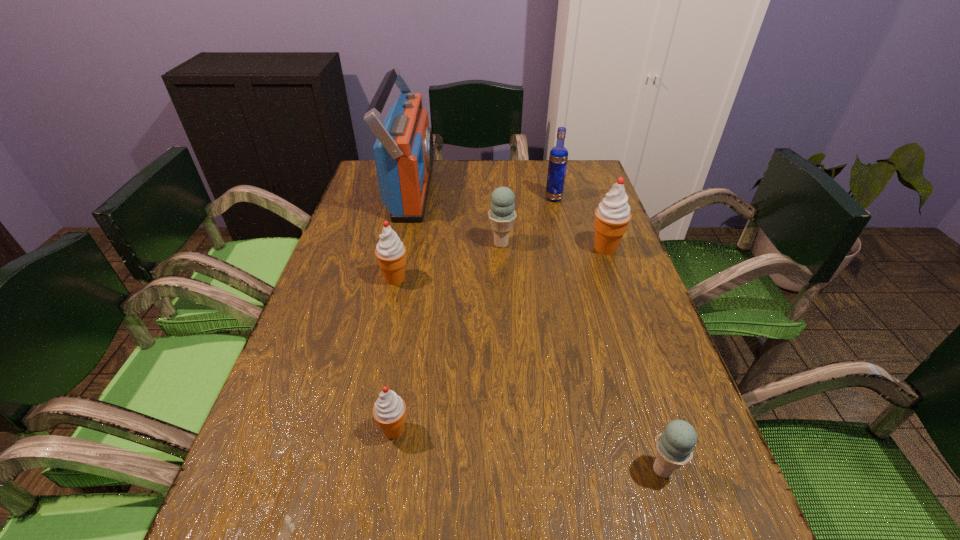
Find the location of `vacant space situated 0.330m on the left of the nearest ice cream`. vacant space situated 0.330m on the left of the nearest ice cream is located at coordinates (442, 470).

Locate an element on the screen. The width and height of the screenshot is (960, 540). radio receiver that is at the far edge is located at coordinates 404,150.

You are a GUI agent. You are given a task and a screenshot of the screen. Output one action in this format:
    pyautogui.click(x=<x>, y=<y>)
    Task: Click on the vodka located at the far edge
    Image resolution: width=960 pixels, height=540 pixels.
    Given the screenshot: What is the action you would take?
    pyautogui.click(x=558, y=157)

This screenshot has width=960, height=540. I want to click on radio receiver that is positioned at the left edge, so click(x=404, y=150).

Where is `icecream present at the left edge`? icecream present at the left edge is located at coordinates (391, 253).

At what (x,y) coordinates should I click in order to perform the action: click on vodka at the right edge. Please return your answer as a coordinate pair (x, y). The height and width of the screenshot is (540, 960). Looking at the image, I should click on (558, 157).

Where is `object at the far left corner`? object at the far left corner is located at coordinates point(404,150).

This screenshot has width=960, height=540. What are the coordinates of `object present at the far right corner` in the screenshot? It's located at (558, 157).

Where is `free space at the far edge of the desktop`? free space at the far edge of the desktop is located at coordinates (440, 174).

Locate an element on the screen. free space at the left edge is located at coordinates (375, 236).